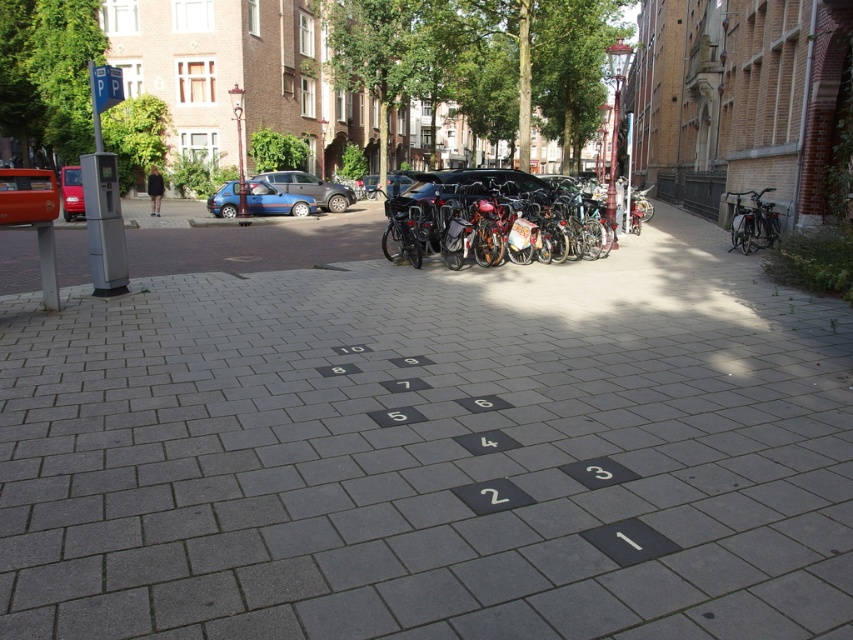
You are a delivery person who needs to park your small delivery van next to the matte red car at left and the shiny metallic bicycle at right. Considering the space they occupy, which object should you park closer to to ensure enough room for your van?

The matte red car at left occupies less space than the shiny metallic bicycle at right, so you should park closer to the matte red car at left to ensure enough room for your van.

You are standing at the hopscotch grid in the urban street scene. There is a matte blue van at center. Where is the matte blue van located relative to the hopscotch grid?

The matte blue van at center is located at point coordinates of (276, 200) relative to the hopscotch grid.

You are standing at the hopscotch grid in the center of the image. Which direction should you face to see the matte red car at left?

You should face to the left to see the matte red car at left since it is located at the left side of the image.